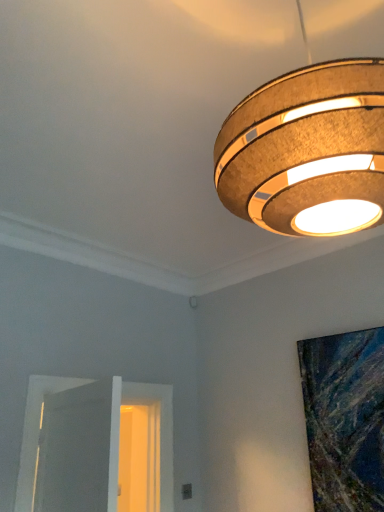
Question: Based on their positions, is white wooden door at lower left located to the left or right of textured cork lampshade at upper right?

Choices:
 (A) right
 (B) left

Answer: (B)

Question: Considering their positions, is white wooden door at lower left located in front of or behind textured cork lampshade at upper right?

Choices:
 (A) behind
 (B) front

Answer: (A)

Question: Which is correct: white wooden door at lower left is inside textured cork lampshade at upper right, or outside of it?

Choices:
 (A) inside
 (B) outside

Answer: (B)

Question: From the image's perspective, is textured cork lampshade at upper right positioned above or below white wooden door at lower left?

Choices:
 (A) below
 (B) above

Answer: (B)

Question: Which is correct: textured cork lampshade at upper right is inside white wooden door at lower left, or outside of it?

Choices:
 (A) outside
 (B) inside

Answer: (A)

Question: Considering the positions of point (336, 109) and point (119, 389), is point (336, 109) closer or farther from the camera than point (119, 389)?

Choices:
 (A) closer
 (B) farther

Answer: (A)

Question: From a real-world perspective, is textured cork lampshade at upper right above or below white wooden door at lower left?

Choices:
 (A) above
 (B) below

Answer: (A)